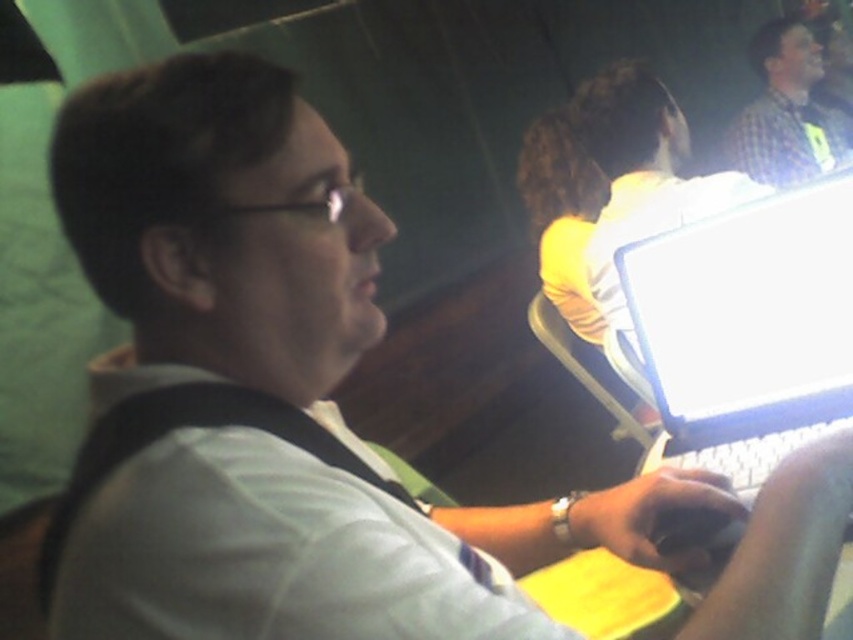
Between point (704, 332) and point (757, 99), which one is positioned in front?

Point (704, 332) is in front.

Does white glossy laptop at center have a smaller size compared to checkered shirt at upper right?

Indeed, white glossy laptop at center has a smaller size compared to checkered shirt at upper right.

Who is more distant from viewer, (717, 387) or (810, 140)?

The point (810, 140) is more distant.

Where is `white glossy laptop at center`? Image resolution: width=853 pixels, height=640 pixels. white glossy laptop at center is located at coordinates (747, 328).